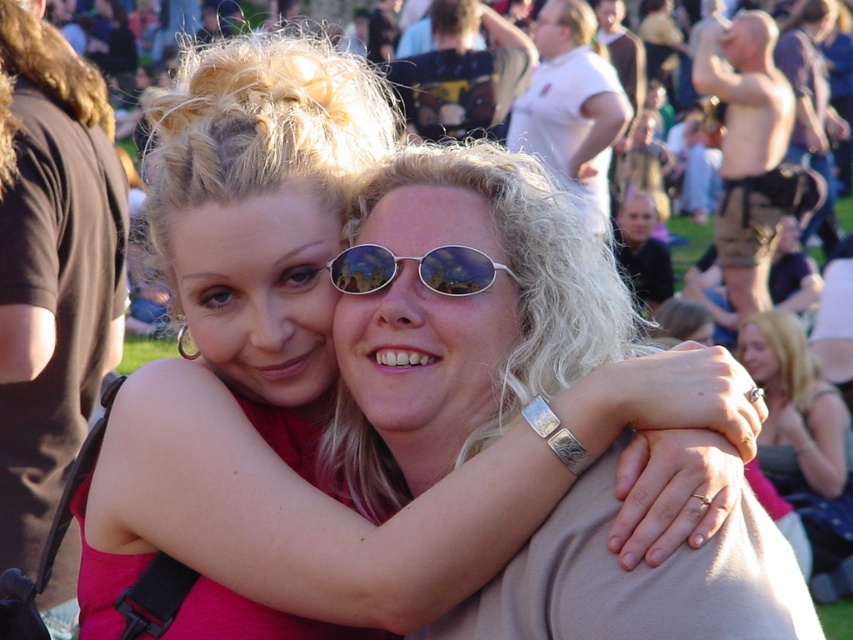
Between blonde hair at center and sunglasses at center, which one has less height?

With less height is blonde hair at center.

Is blonde hair at center below sunglasses at center?

Indeed, blonde hair at center is positioned under sunglasses at center.

What do you see at coordinates (804, 444) in the screenshot?
I see `blonde hair at center` at bounding box center [804, 444].

The width and height of the screenshot is (853, 640). Find the location of `blonde hair at center`. blonde hair at center is located at coordinates (804, 444).